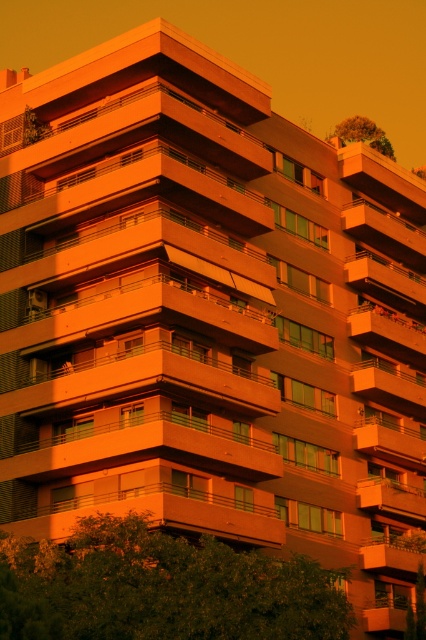
Is green leafy tree at lower center positioned at the back of green leafy tree at upper right?

That is False.

Is green leafy tree at lower center above green leafy tree at upper right?

No, green leafy tree at lower center is not above green leafy tree at upper right.

The height and width of the screenshot is (640, 426). I want to click on green leafy tree at lower center, so click(161, 588).